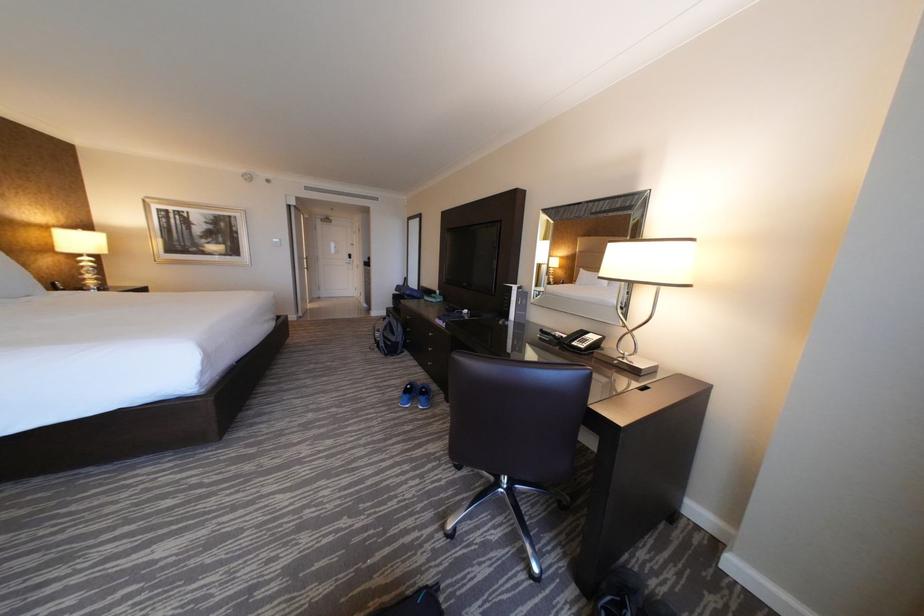
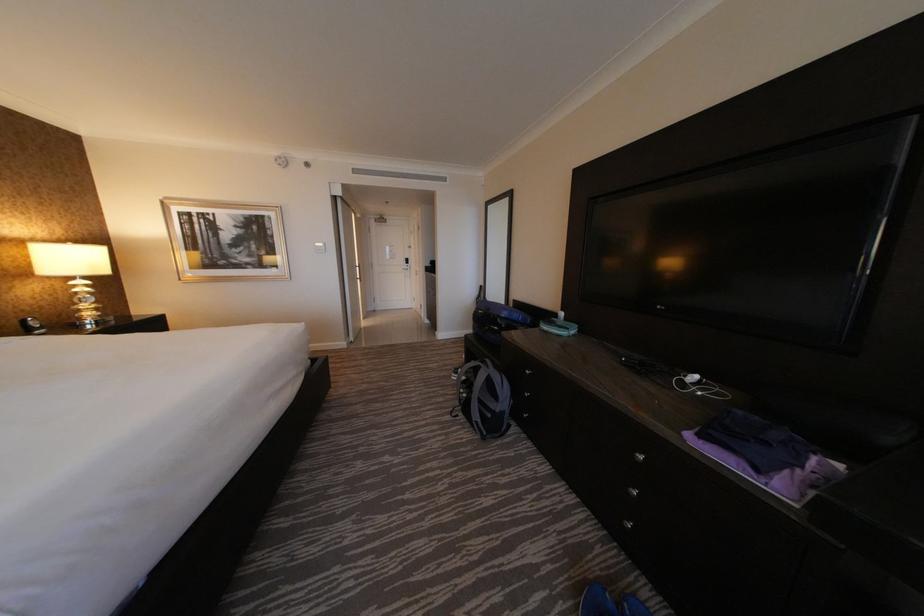
Which direction would the cameraman need to move to produce the second image?

The movement direction of the cameraman is left, forward.